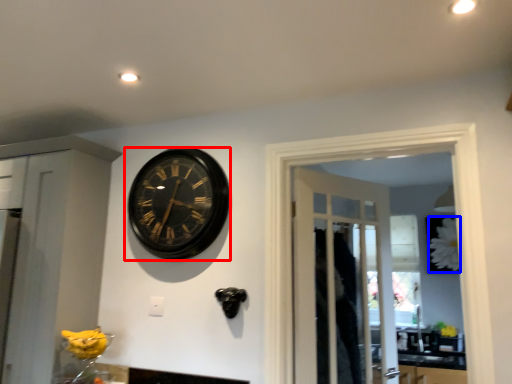
Question: Which object is closer to the camera taking this photo, wall clock (highlighted by a red box) or flower (highlighted by a blue box)?

Choices:
 (A) wall clock
 (B) flower

Answer: (A)